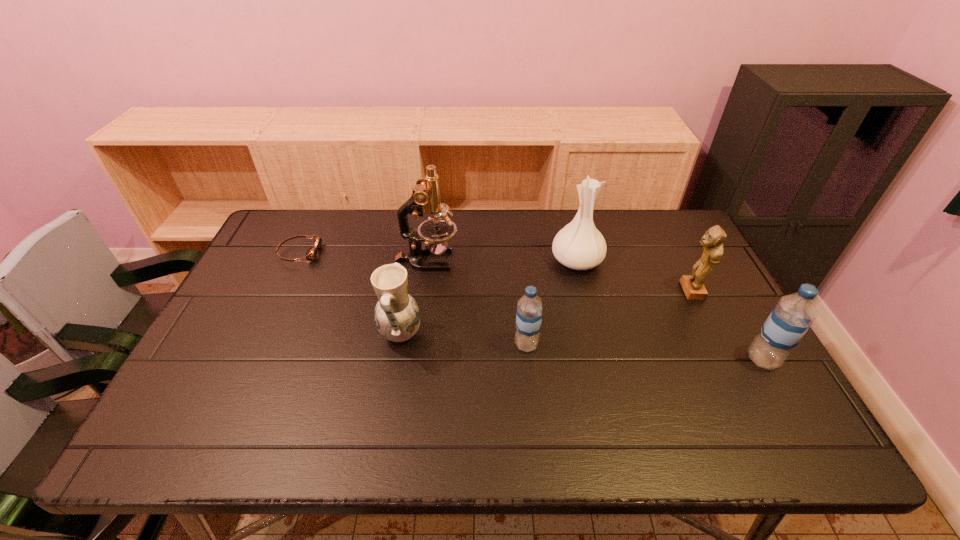
Observe the arrangement of all water bottles in the image. To keep them evenly spaced, where would you place another water bottle on the left? Please locate a free space. Please provide its 2D coordinates. Your answer should be formatted as a tuple, i.e. [(x, y)], where the tuple contains the x and y coordinates of a point satisfying the conditions above.

[(304, 330)]